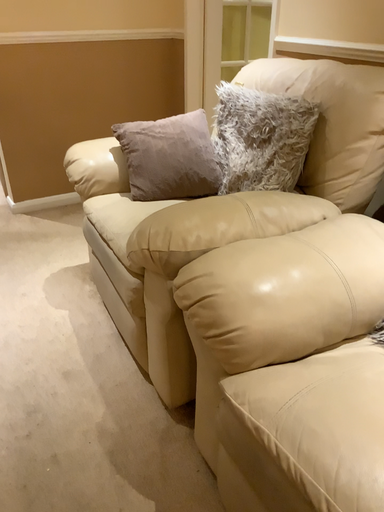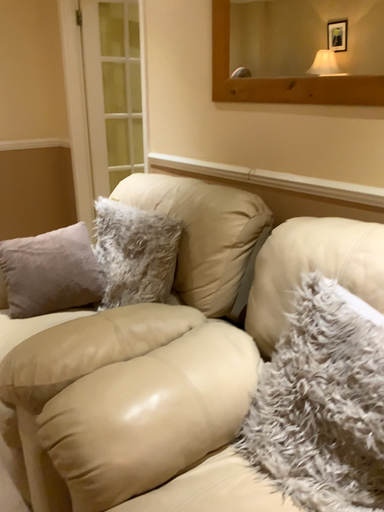
Question: How did the camera likely rotate when shooting the video?

Choices:
 (A) rotated right
 (B) rotated left

Answer: (A)